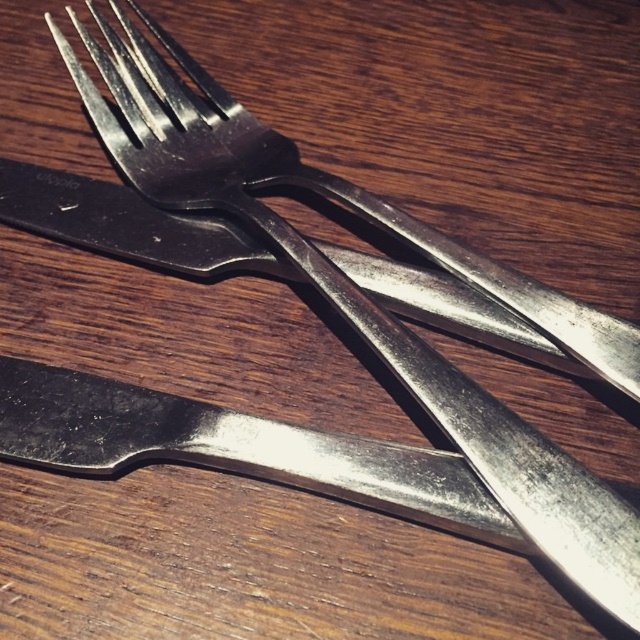
You are setting a table and need to place the polished silver knife at lower left and the polished metal fork at center correctly according to the image. Which one should be placed to the right side of the other?

The polished silver knife at lower left should be placed to the left of the polished metal fork at center, so the fork is on the right side.

You need to choose between the polished silver knife at lower left and the polished metal fork at center for a task that requires a longer tool. Which one should you pick?

The polished metal fork at center is longer than the polished silver knife at lower left, so you should pick the polished metal fork at center.

You are a chef organizing your kitchen tools. You need to place a new spice jar on the wooden surface where the polished silver knife at lower left is located. The spice jar requires a spot that is not directly under the knife. Based on the image, where should you place the spice jar?

The polished silver knife at lower left is located at point (x=234, y=449). To avoid placing the spice jar directly under it, choose a different coordinate on the wooden surface that is not at that specific point.